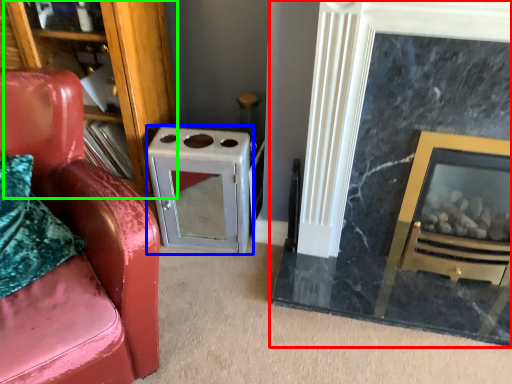
Question: Considering the real-world distances, which object is closest to fireplace (highlighted by a red box)? appliance (highlighted by a blue box) or bookshelf (highlighted by a green box).

Choices:
 (A) appliance
 (B) bookshelf

Answer: (A)